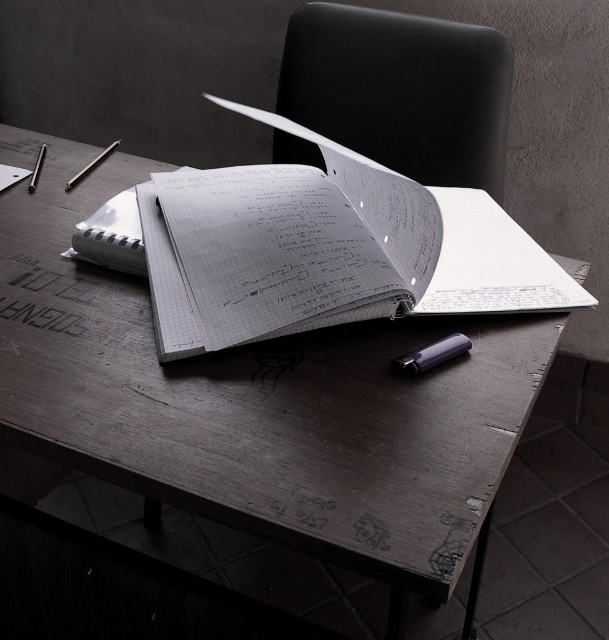
Who is taller, white paper notebook at center or matte purple pencil at center?

white paper notebook at center

Is point (357, 220) in front of point (414, 369)?

No, it is not.

This screenshot has width=609, height=640. In order to click on white paper notebook at center in this screenshot , I will do `click(325, 248)`.

Who is more distant from viewer, (376, 13) or (404, 353)?

Positioned behind is point (376, 13).

Between black leather chair at upper center and matte purple pencil at center, which one appears on the right side from the viewer's perspective?

Positioned to the right is black leather chair at upper center.

Between point (353, 138) and point (452, 353), which one is positioned behind?

Point (353, 138)

This screenshot has width=609, height=640. I want to click on black leather chair at upper center, so click(401, 90).

Can you confirm if white paper notebook at center is bigger than black leather chair at upper center?

Correct, white paper notebook at center is larger in size than black leather chair at upper center.

The image size is (609, 640). Describe the element at coordinates (325, 248) in the screenshot. I see `white paper notebook at center` at that location.

Locate an element on the screen. white paper notebook at center is located at coordinates (325, 248).